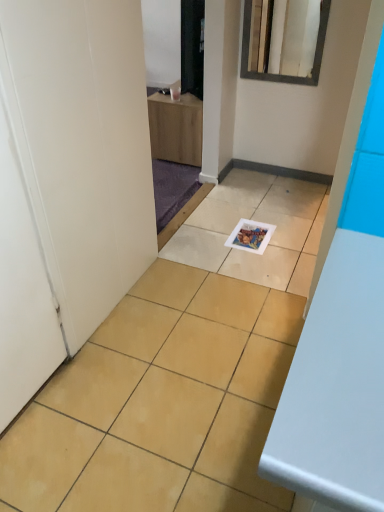
What are the coordinates of `free space in front of matte paper magazine at center` in the screenshot? It's located at tap(251, 266).